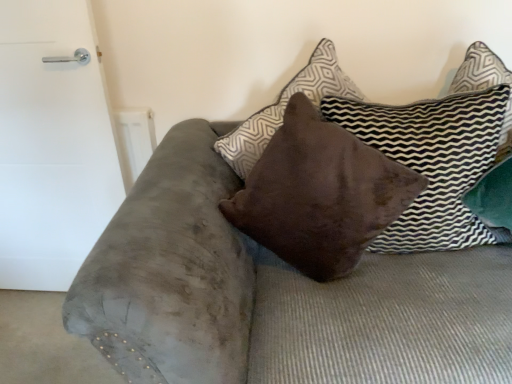
Question: From their relative heights in the image, would you say brown velvet pillow at center, which is the 2th pillow from left to right, is taller or shorter than brown suede pillow at center, positioned as the second pillow in right-to-left order?

Choices:
 (A) short
 (B) tall

Answer: (A)

Question: Would you say brown velvet pillow at center, which is the 2th pillow from left to right, is inside or outside brown suede pillow at center, positioned as the second pillow in right-to-left order?

Choices:
 (A) outside
 (B) inside

Answer: (A)

Question: Which is nearer to the white matte door at left?

Choices:
 (A) brown suede pillow at center, positioned as the 1th pillow in left-to-right order
 (B) brown velvet pillow at center, the 1th pillow in the right-to-left sequence

Answer: (A)

Question: Considering the real-world distances, which object is farthest from the brown suede pillow at center, positioned as the second pillow in right-to-left order?

Choices:
 (A) white matte door at left
 (B) brown velvet pillow at center, which is the 2th pillow from left to right

Answer: (A)